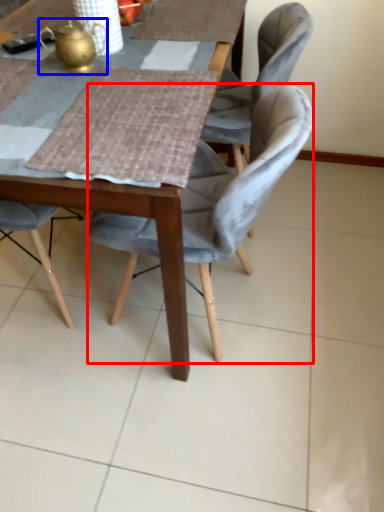
Question: Which point is closer to the camera, chair (highlighted by a red box) or tea pot (highlighted by a blue box)?

Choices:
 (A) chair
 (B) tea pot

Answer: (A)